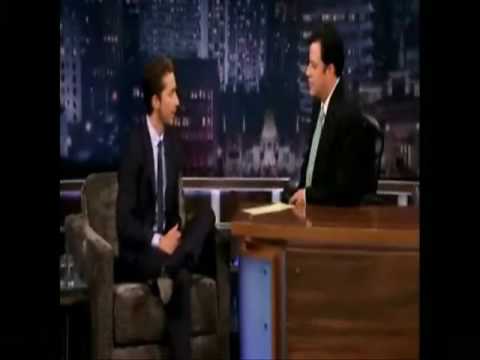
This screenshot has width=480, height=360. I want to click on desk top, so click(352, 222).